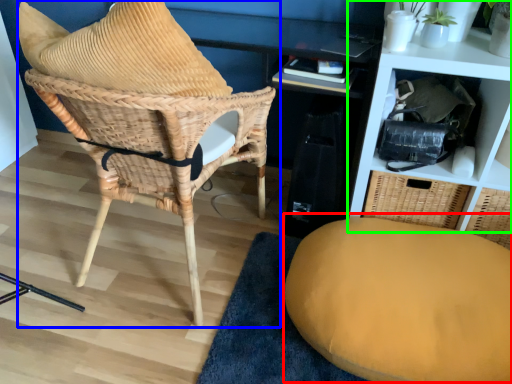
Question: Estimate the real-world distances between objects in this image. Which object is farther from swivel chair (highlighted by a red box), chair (highlighted by a blue box) or shelf (highlighted by a green box)?

Choices:
 (A) chair
 (B) shelf

Answer: (A)